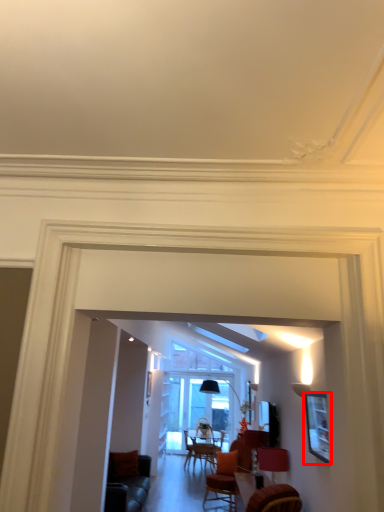
Question: From the image's perspective, considering the relative positions of picture frame (annotated by the red box) and lamp in the image provided, where is picture frame (annotated by the red box) located with respect to the staircase?

Choices:
 (A) below
 (B) above

Answer: (B)